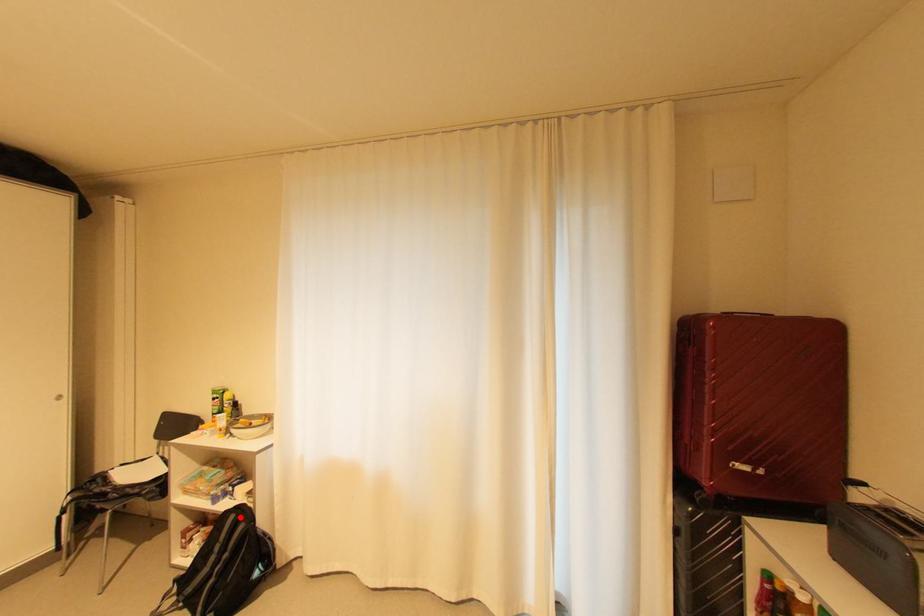
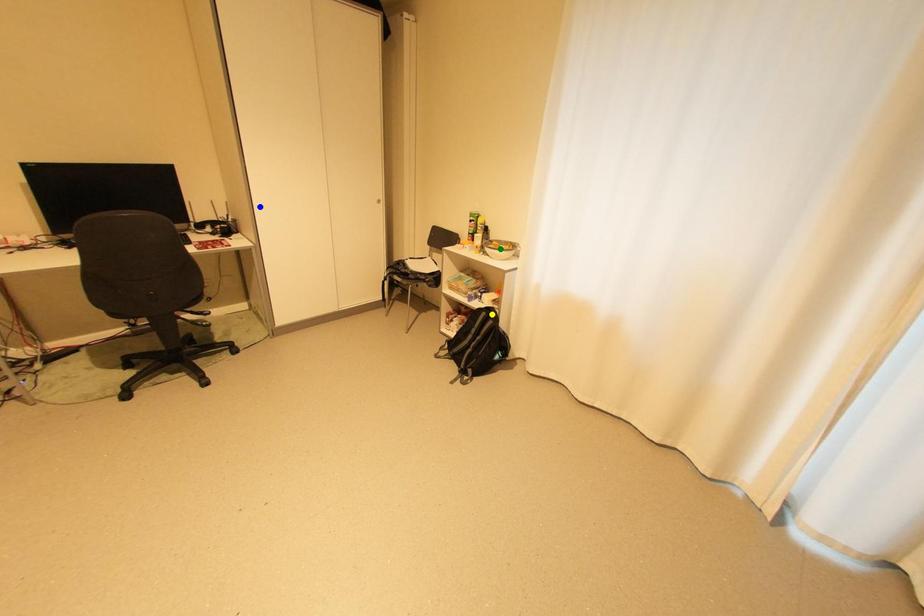
Question: I am providing you with two images of the same scene from different viewpoints. A red point is marked on the first image. You are given multiple points on the second image. In image 2, which mark is for the same physical point as the one in image 1?

Choices:
 (A) blue point
 (B) yellow point
 (C) green point

Answer: (B)